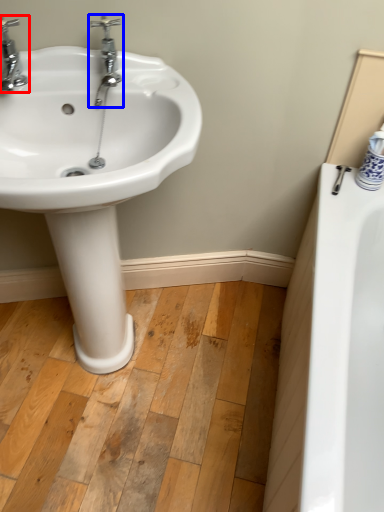
Question: Which object is closer to the camera taking this photo, tap (highlighted by a red box) or tap (highlighted by a blue box)?

Choices:
 (A) tap
 (B) tap

Answer: (A)